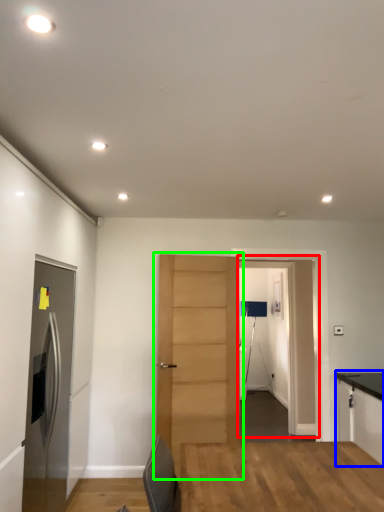
Question: Which object is positioned closest to glass door (highlighted by a red box)? Select from cabinetry (highlighted by a blue box) and door (highlighted by a green box).

Choices:
 (A) cabinetry
 (B) door

Answer: (A)